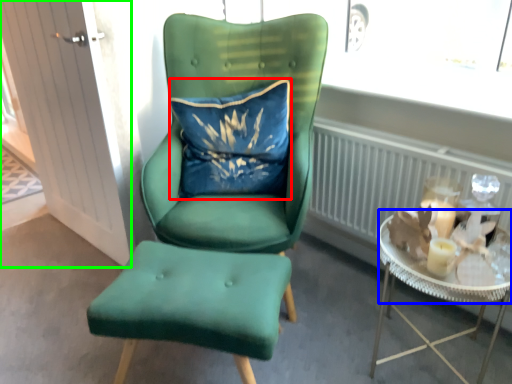
Question: Which object is the closest to the pillow (highlighted by a red box)? Choose among these: glass table (highlighted by a blue box) or glass door (highlighted by a green box).

Choices:
 (A) glass table
 (B) glass door

Answer: (B)